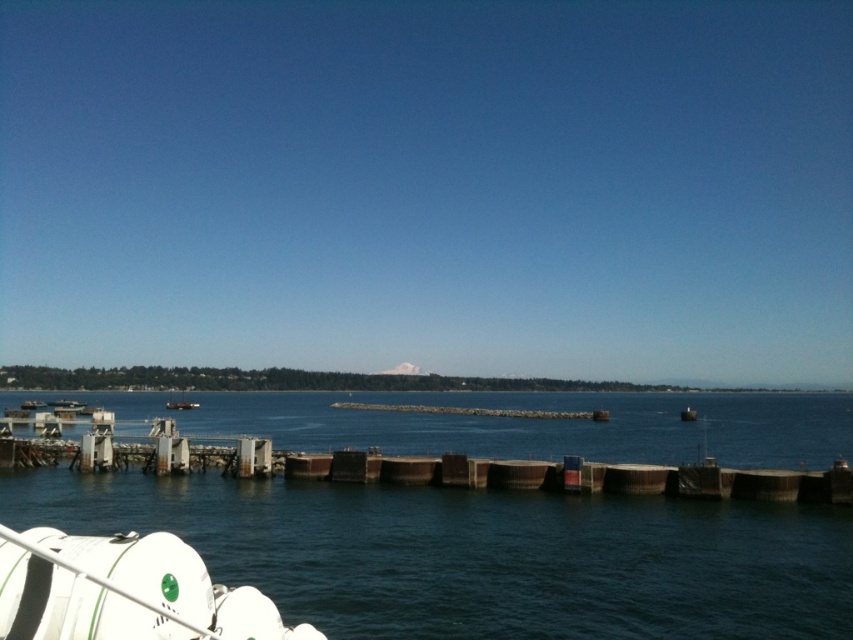
Question: Can you confirm if white matte lifeboat at lower left is positioned to the right of metallic gray boat at center?

Choices:
 (A) no
 (B) yes

Answer: (B)

Question: Is the position of dark blue water at center more distant than that of white matte lifeboat at lower left?

Choices:
 (A) no
 (B) yes

Answer: (B)

Question: Which object is positioned farthest from the dark blue water at center?

Choices:
 (A) smooth gray buoy at center
 (B) metallic gray boat at center
 (C) white matte lifeboat at lower left

Answer: (B)

Question: Does metallic gray boat at center appear under smooth gray buoy at center?

Choices:
 (A) yes
 (B) no

Answer: (A)

Question: Considering the real-world distances, which object is closest to the white matte lifeboat at lower left?

Choices:
 (A) smooth gray buoy at center
 (B) metallic gray boat at center

Answer: (A)

Question: Considering the real-world distances, which object is closest to the smooth gray buoy at center?

Choices:
 (A) metallic gray boat at center
 (B) dark blue water at center

Answer: (B)